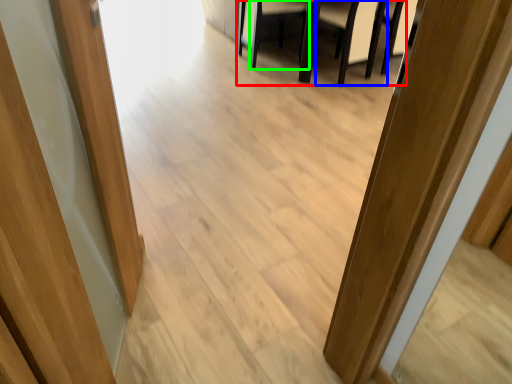
Question: Which is farther away from furniture (highlighted by a red box)? armchair (highlighted by a blue box) or armchair (highlighted by a green box)?

Choices:
 (A) armchair
 (B) armchair

Answer: (B)